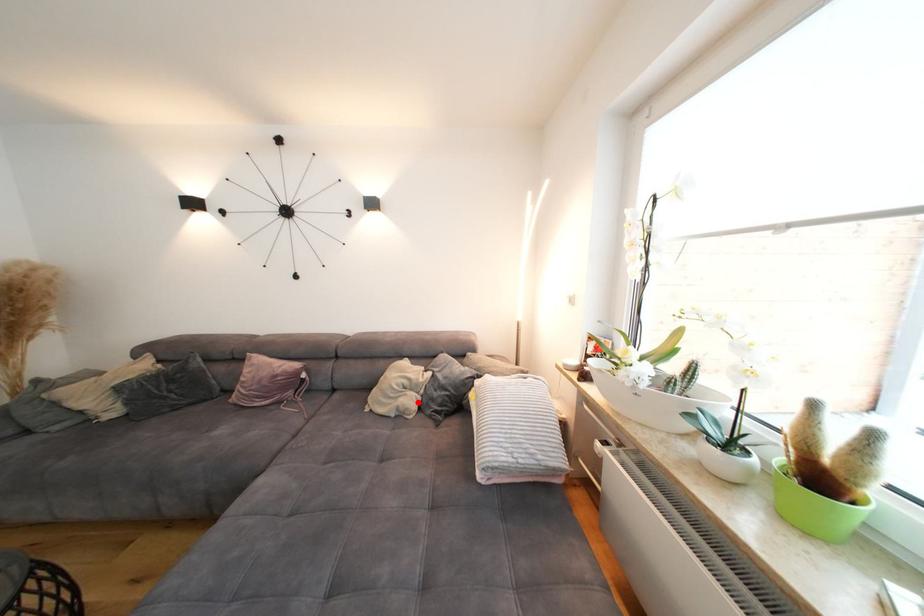
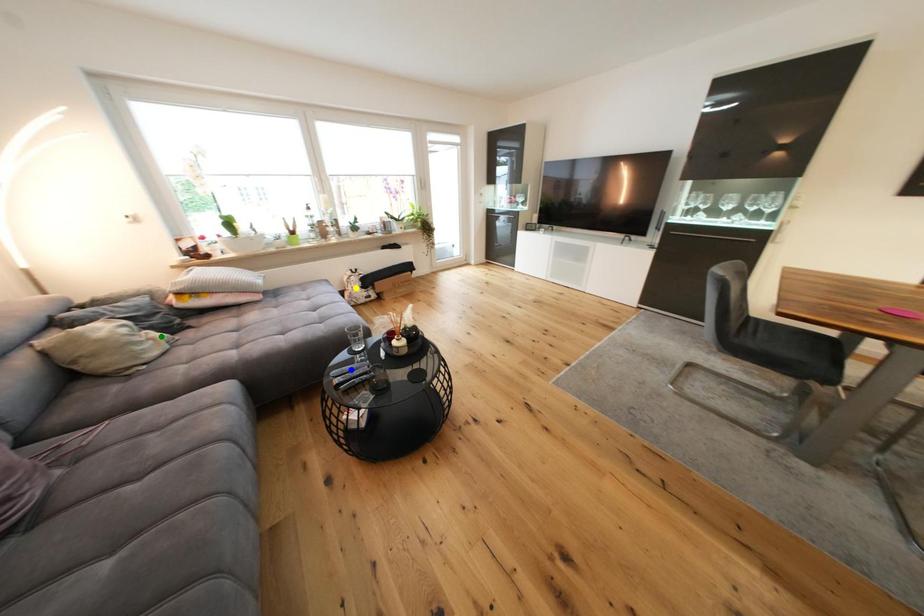
Question: I am providing you with two images of the same scene from different viewpoints. A red point is marked on the first image. You are given multiple points on the second image. Which point in image 2 represents the same 3d spot as the red point in image 1?

Choices:
 (A) blue point
 (B) yellow point
 (C) green point

Answer: (C)